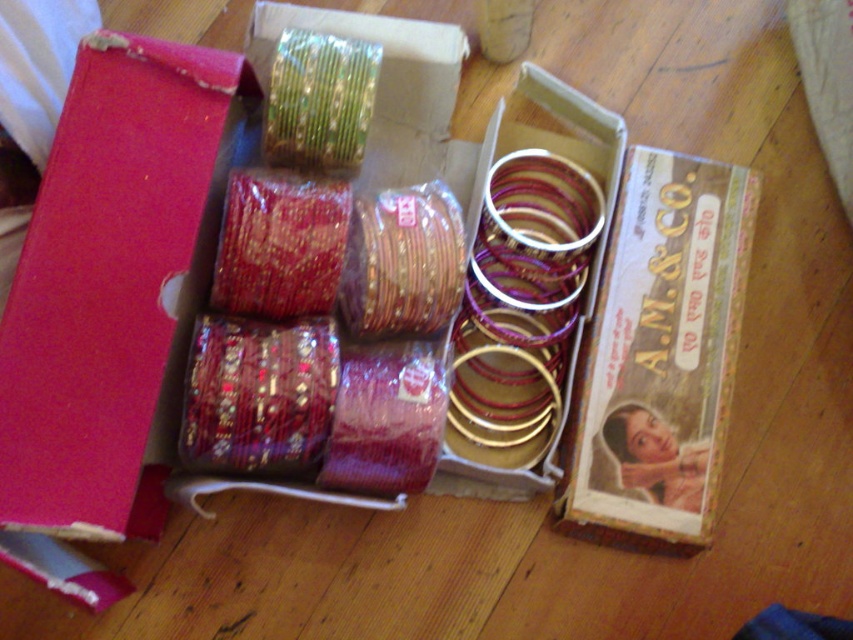
Question: Which is farther from the shiny metallic bangles at center?

Choices:
 (A) green metallic bangle at upper left
 (B) shiny red elastic band at center

Answer: (A)

Question: Does shiny purple elastic band at center have a greater width compared to shiny red elastic band at center?

Choices:
 (A) no
 (B) yes

Answer: (B)

Question: Can you confirm if shiny purple elastic band at center is positioned below shiny red elastic band at center?

Choices:
 (A) yes
 (B) no

Answer: (A)

Question: Which of the following is the closest to the observer?

Choices:
 (A) shiny purple elastic band at center
 (B) green metallic bangle at upper left
 (C) shiny metallic bangles at center
 (D) shiny red elastic band at center

Answer: (A)

Question: Which object is farther from the camera taking this photo?

Choices:
 (A) shiny red elastic band at center
 (B) green metallic bangle at upper left
 (C) shiny metallic bangles at center

Answer: (C)

Question: Is shiny purple elastic band at center positioned before shiny red elastic band at center?

Choices:
 (A) yes
 (B) no

Answer: (A)